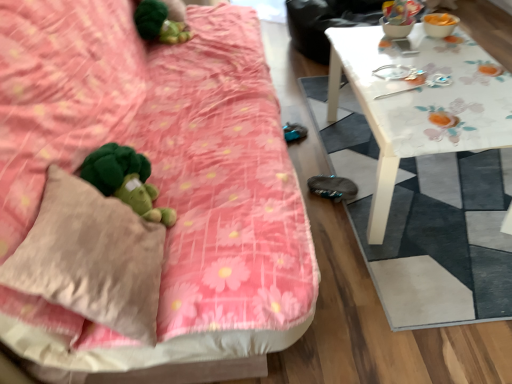
Question: Considering the relative sizes of white floral-patterned mat at right and pink floral fabric couch at center in the image provided, is white floral-patterned mat at right smaller than pink floral fabric couch at center?

Choices:
 (A) yes
 (B) no

Answer: (A)

Question: Does white floral-patterned mat at right turn towards pink floral fabric couch at center?

Choices:
 (A) yes
 (B) no

Answer: (B)

Question: Is white floral-patterned mat at right positioned far away from pink floral fabric couch at center?

Choices:
 (A) yes
 (B) no

Answer: (B)

Question: From a real-world perspective, is white floral-patterned mat at right located beneath pink floral fabric couch at center?

Choices:
 (A) yes
 (B) no

Answer: (A)

Question: Is white floral-patterned mat at right looking in the opposite direction of pink floral fabric couch at center?

Choices:
 (A) yes
 (B) no

Answer: (B)

Question: From a real-world perspective, is white floral-patterned mat at right located higher than pink floral fabric couch at center?

Choices:
 (A) no
 (B) yes

Answer: (A)

Question: Is white floral-patterned mat at right taller than green plush toy at lower left?

Choices:
 (A) no
 (B) yes

Answer: (A)

Question: Is white floral-patterned mat at right in contact with green plush toy at lower left?

Choices:
 (A) no
 (B) yes

Answer: (A)

Question: From the image's perspective, does white floral-patterned mat at right appear higher than green plush toy at lower left?

Choices:
 (A) yes
 (B) no

Answer: (A)

Question: Is white floral-patterned mat at right wider than green plush toy at lower left?

Choices:
 (A) yes
 (B) no

Answer: (A)

Question: From a real-world perspective, is white floral-patterned mat at right over green plush toy at lower left?

Choices:
 (A) no
 (B) yes

Answer: (A)

Question: Is white floral-patterned mat at right at the right side of green plush toy at lower left?

Choices:
 (A) no
 (B) yes

Answer: (B)

Question: Is green plush toy at lower left bigger than green plush toy at upper left?

Choices:
 (A) yes
 (B) no

Answer: (A)